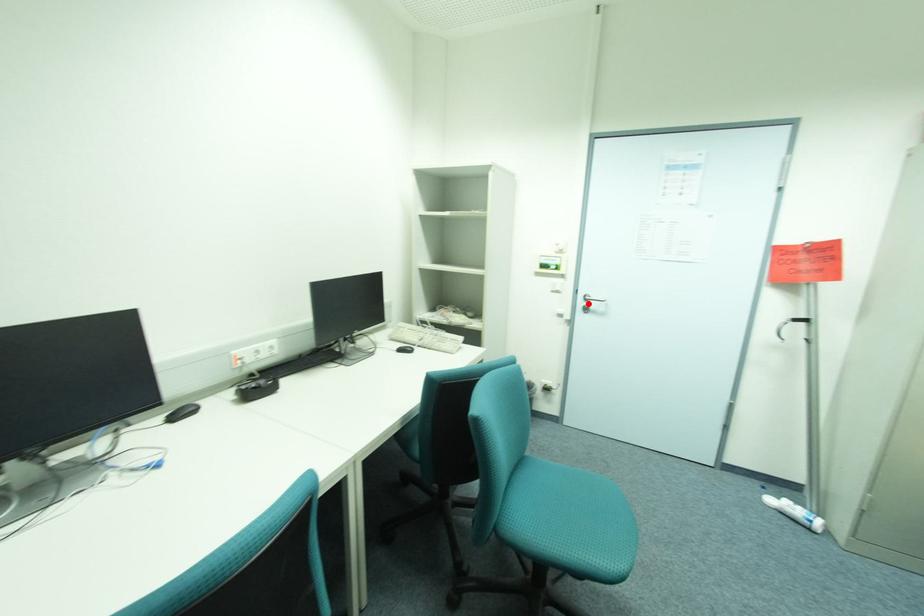
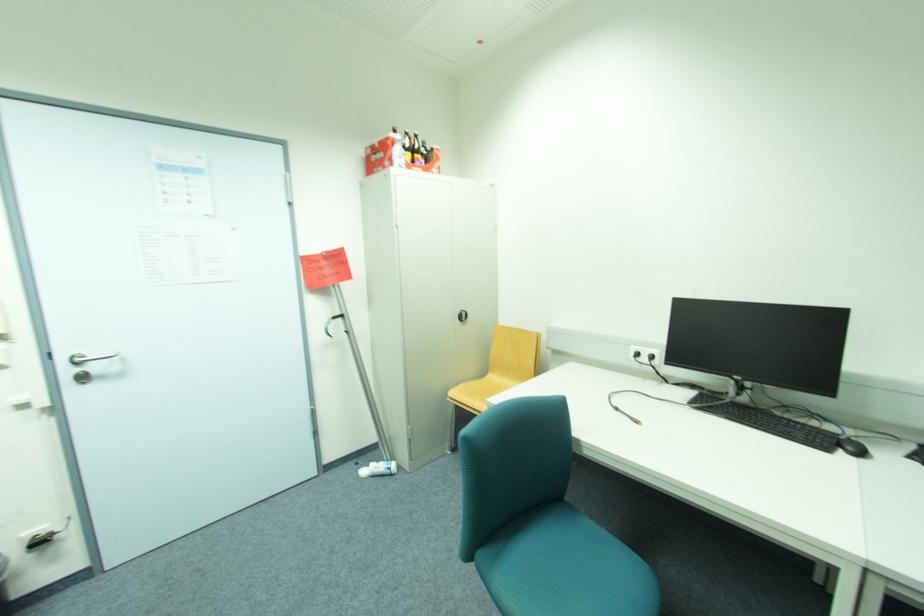
Question: I am providing you with two images of the same scene from different viewpoints. Given a red point in image1, look at the same physical point in image2. Is it:

Choices:
 (A) Closer to the viewpoint
 (B) Farther from the viewpoint

Answer: (B)